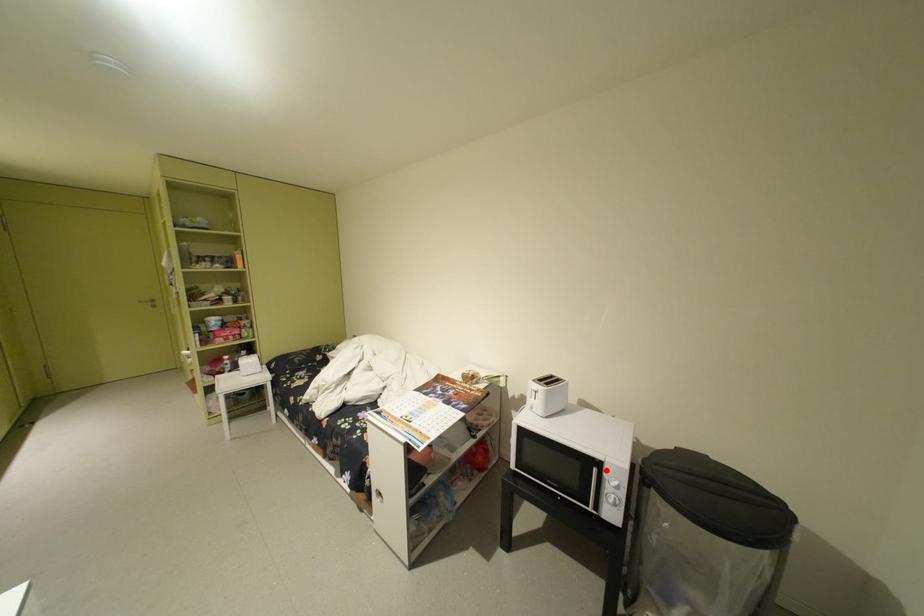
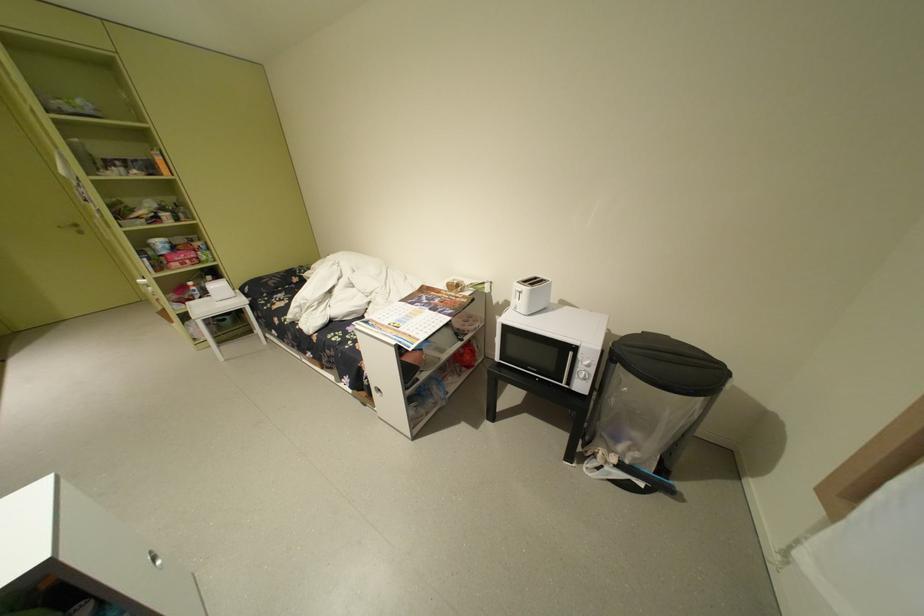
Question: I am providing you with two images of the same scene from different viewpoints. Given a red point in image1, look at the same physical point in image2. Is it:

Choices:
 (A) Closer to the viewpoint
 (B) Farther from the viewpoint

Answer: (A)